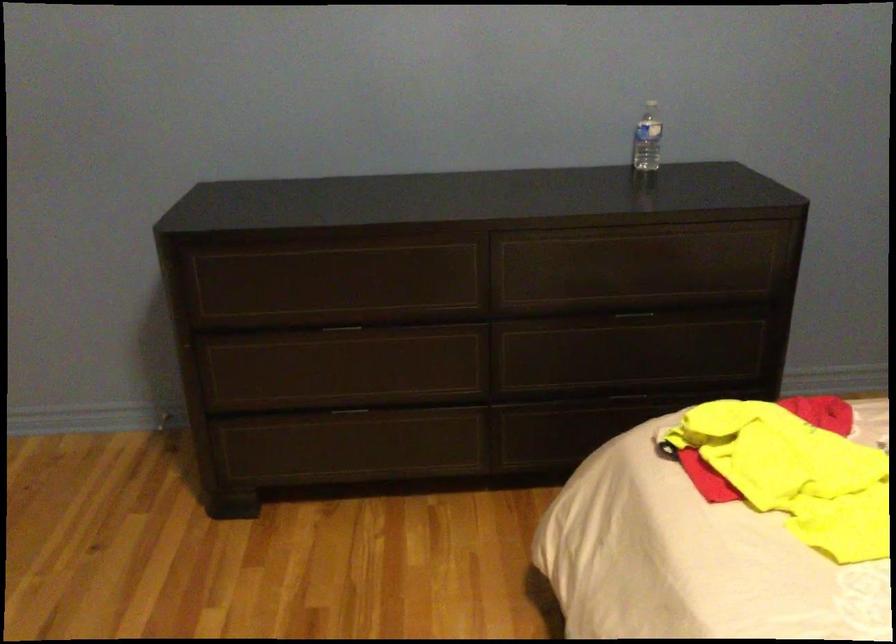
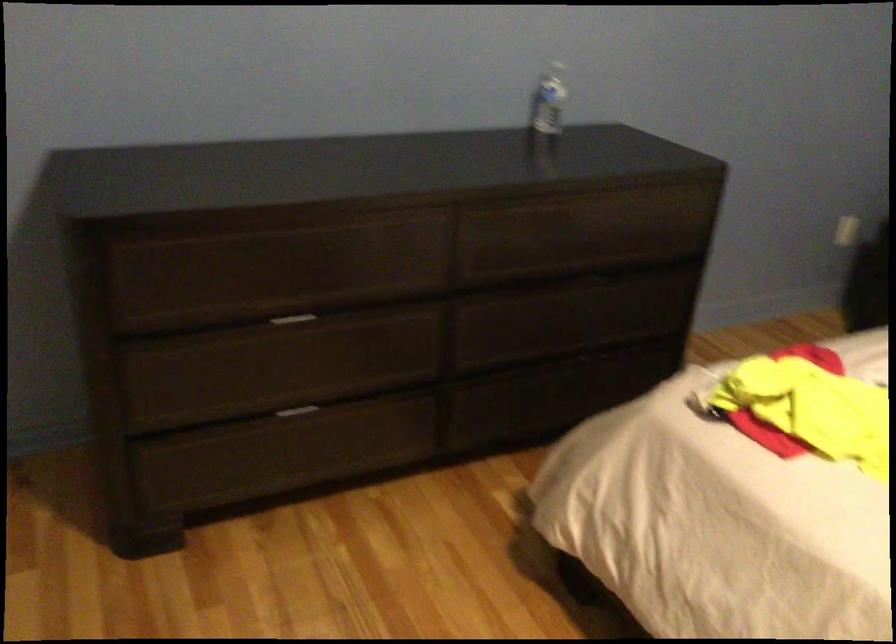
Where in the second image is the point corresponding to the point at 341,328 from the first image?

(291, 319)